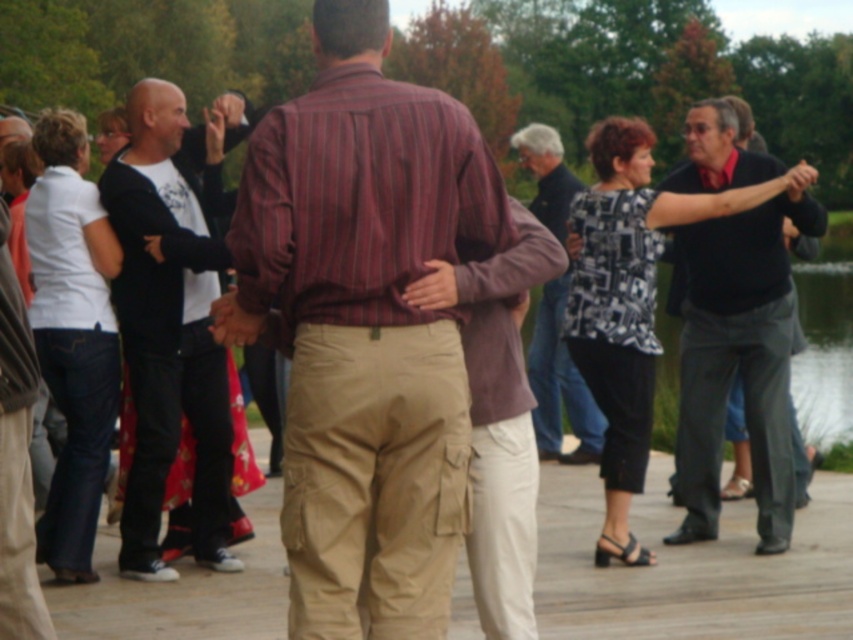
Question: Does dark gray pants at right have a smaller size compared to khaki cargo pants at center?

Choices:
 (A) no
 (B) yes

Answer: (A)

Question: Which object is closer to the camera taking this photo?

Choices:
 (A) dark gray pants at right
 (B) black cotton shirt at left
 (C) striped cotton shirt at center
 (D) khaki cargo pants at center

Answer: (C)

Question: Which of the following is the closest to the observer?

Choices:
 (A) dark gray pants at right
 (B) striped cotton shirt at center

Answer: (B)

Question: Among these objects, which one is farthest from the camera?

Choices:
 (A) khaki cargo pants at center
 (B) dark gray pants at right
 (C) dark blue shirt at center

Answer: (C)

Question: Is striped cotton shirt at center to the left of black cotton shirt at left from the viewer's perspective?

Choices:
 (A) no
 (B) yes

Answer: (A)

Question: Can you confirm if striped cotton shirt at center is positioned below khaki cargo pants at center?

Choices:
 (A) yes
 (B) no

Answer: (B)